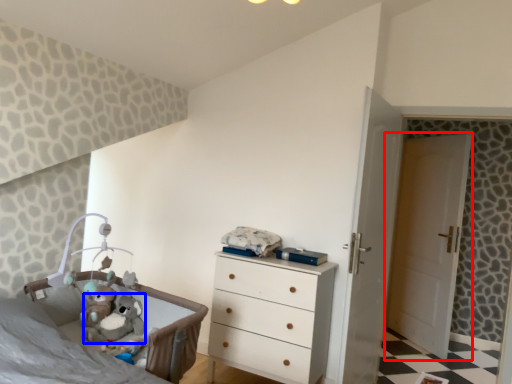
Question: Which point is further to the camera, door (highlighted by a red box) or animal (highlighted by a blue box)?

Choices:
 (A) door
 (B) animal

Answer: (A)